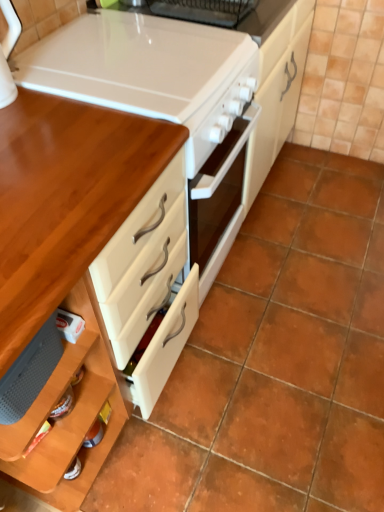
Question: From a real-world perspective, is wooden table at left physically below white glossy stove at upper center?

Choices:
 (A) no
 (B) yes

Answer: (B)

Question: Is wooden table at left at the right side of white glossy stove at upper center?

Choices:
 (A) yes
 (B) no

Answer: (B)

Question: Does wooden table at left have a lesser height compared to white glossy stove at upper center?

Choices:
 (A) yes
 (B) no

Answer: (B)

Question: Would you consider wooden table at left to be distant from white glossy stove at upper center?

Choices:
 (A) yes
 (B) no

Answer: (B)

Question: Is wooden table at left to the left of white glossy stove at upper center from the viewer's perspective?

Choices:
 (A) no
 (B) yes

Answer: (B)

Question: Is wooden table at left positioned behind white glossy stove at upper center?

Choices:
 (A) yes
 (B) no

Answer: (B)

Question: From the image's perspective, does white glossy stove at upper center appear lower than wooden table at left?

Choices:
 (A) no
 (B) yes

Answer: (A)

Question: Could wooden table at left be considered to be inside white glossy stove at upper center?

Choices:
 (A) yes
 (B) no

Answer: (B)

Question: Does white glossy stove at upper center appear on the left side of wooden table at left?

Choices:
 (A) yes
 (B) no

Answer: (B)

Question: Considering the relative positions of white glossy stove at upper center and wooden table at left in the image provided, is white glossy stove at upper center behind wooden table at left?

Choices:
 (A) no
 (B) yes

Answer: (B)

Question: From the image's perspective, is white glossy stove at upper center on wooden table at left?

Choices:
 (A) yes
 (B) no

Answer: (A)

Question: Does white glossy stove at upper center turn towards wooden table at left?

Choices:
 (A) yes
 (B) no

Answer: (B)

Question: Looking at the image, does wooden table at left seem bigger or smaller compared to white glossy stove at upper center?

Choices:
 (A) big
 (B) small

Answer: (A)